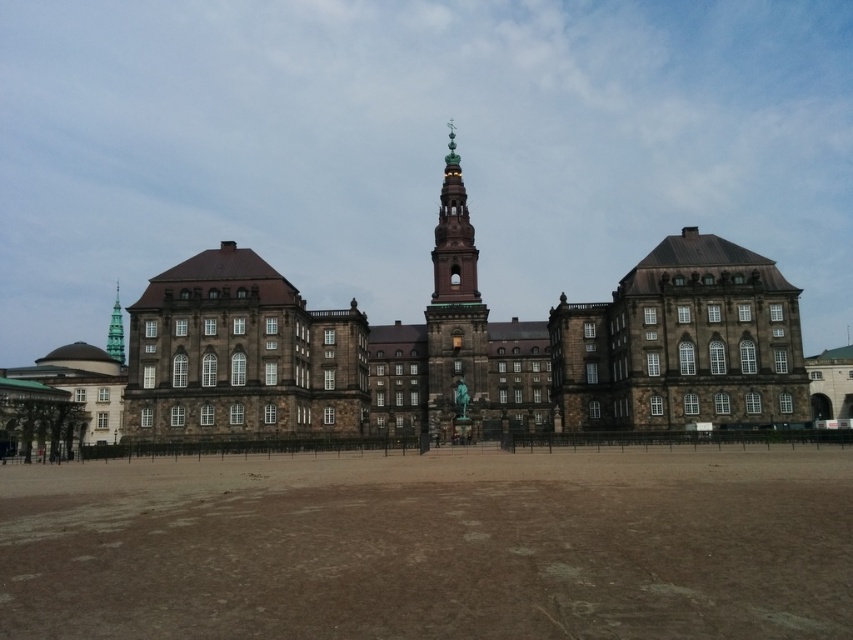
You are standing in front of the grand historic building. There is a point marked at coordinates (463, 356). What does this point represent?

The point at coordinates (463, 356) represents the brown stone building at center.

You are an architect evaluating the structural integrity of the brown stone building at center and the green glass bell tower at upper center. Based on their positions, which one is more likely to block sunlight to the courtyard in front of them?

The brown stone building at center is positioned over the green glass bell tower at upper center, so the brown stone building at center is lower and closer to the courtyard. Therefore, it would block sunlight to the courtyard first before the green glass bell tower at upper center.